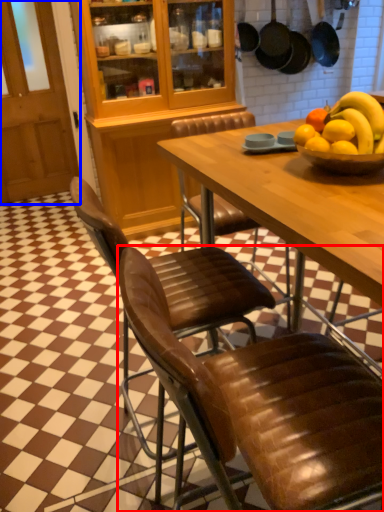
Question: Which of the following is the farthest to the observer, chair (highlighted by a red box) or glass door (highlighted by a blue box)?

Choices:
 (A) chair
 (B) glass door

Answer: (B)